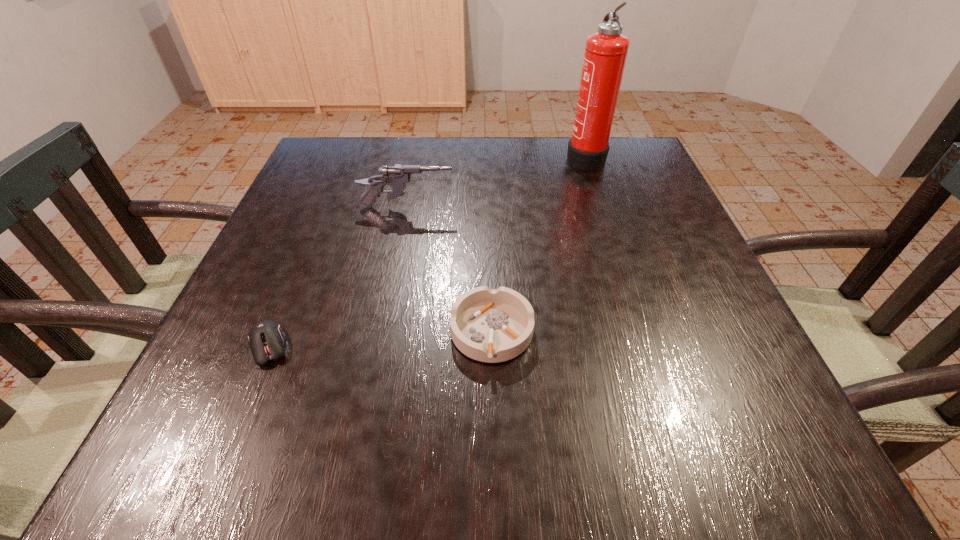
The width and height of the screenshot is (960, 540). I want to click on free space at the right edge of the desktop, so click(650, 223).

Where is `vacant space at the far left corner of the desktop`? The width and height of the screenshot is (960, 540). vacant space at the far left corner of the desktop is located at coordinates (313, 182).

In the image, there is a desktop. Where is `vacant space at the far right corner`? The height and width of the screenshot is (540, 960). vacant space at the far right corner is located at coordinates (613, 139).

At what (x,y) coordinates should I click in order to perform the action: click on free space between the computer mouse and the second tallest object. Please return your answer as a coordinate pair (x, y). Image resolution: width=960 pixels, height=540 pixels. Looking at the image, I should click on (338, 277).

Identify the location of blank region between the ashtray and the rightmost object. (539, 245).

Locate an element on the screen. free point between the shortest object and the third object from left to right is located at coordinates (380, 340).

The height and width of the screenshot is (540, 960). Find the location of `free space between the second farthest object and the ashtray`. free space between the second farthest object and the ashtray is located at coordinates (449, 269).

You are a GUI agent. You are given a task and a screenshot of the screen. Output one action in this format:
    pyautogui.click(x=<x>, y=<y>)
    Task: Click on the free space between the computer mouse and the second farthest object
    The width and height of the screenshot is (960, 540).
    Given the screenshot: What is the action you would take?
    338,277

The width and height of the screenshot is (960, 540). In order to click on vacant space that is in between the third object from right to left and the farthest object in this screenshot , I will do click(x=496, y=182).

Find the location of a particular element. The width and height of the screenshot is (960, 540). free space that is in between the ashtray and the leftmost object is located at coordinates (380, 340).